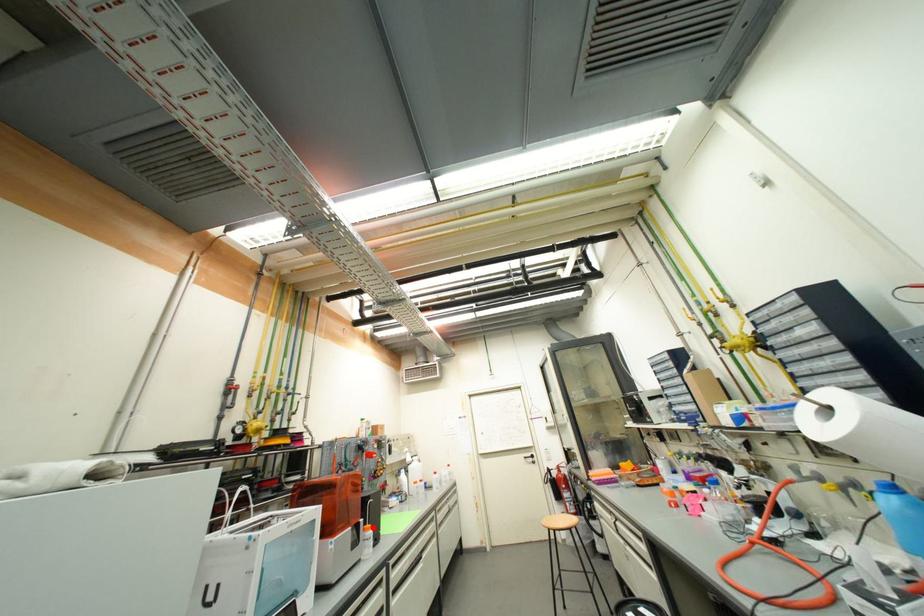
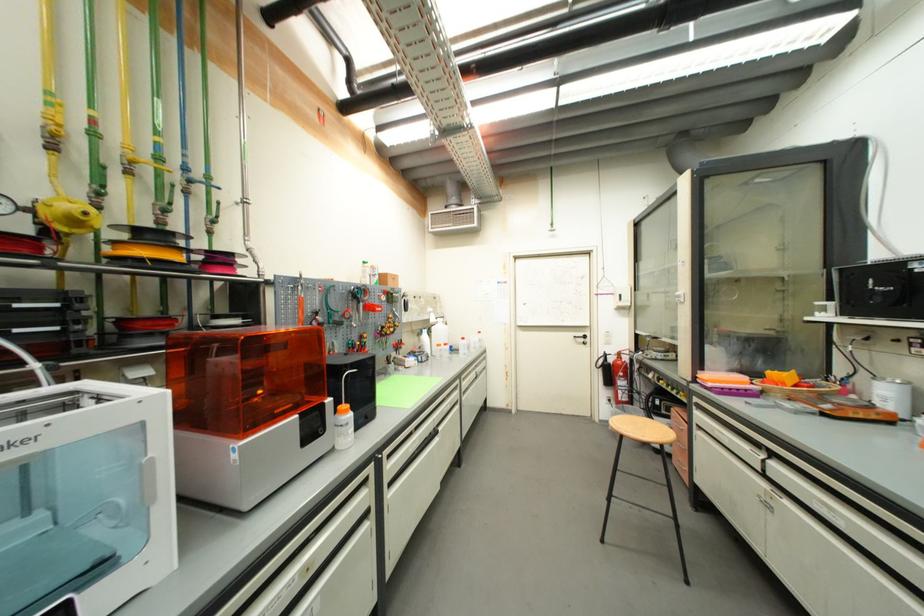
Question: I am providing you with two images of the same scene from different viewpoints. Given a red point in image1, look at the same physical point in image2. Is it:

Choices:
 (A) Closer to the viewpoint
 (B) Farther from the viewpoint

Answer: (B)